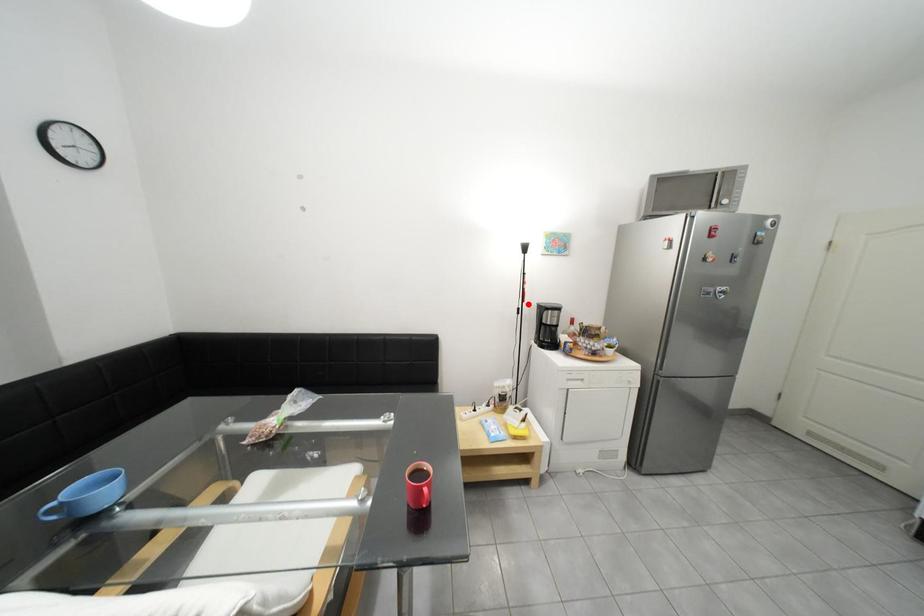
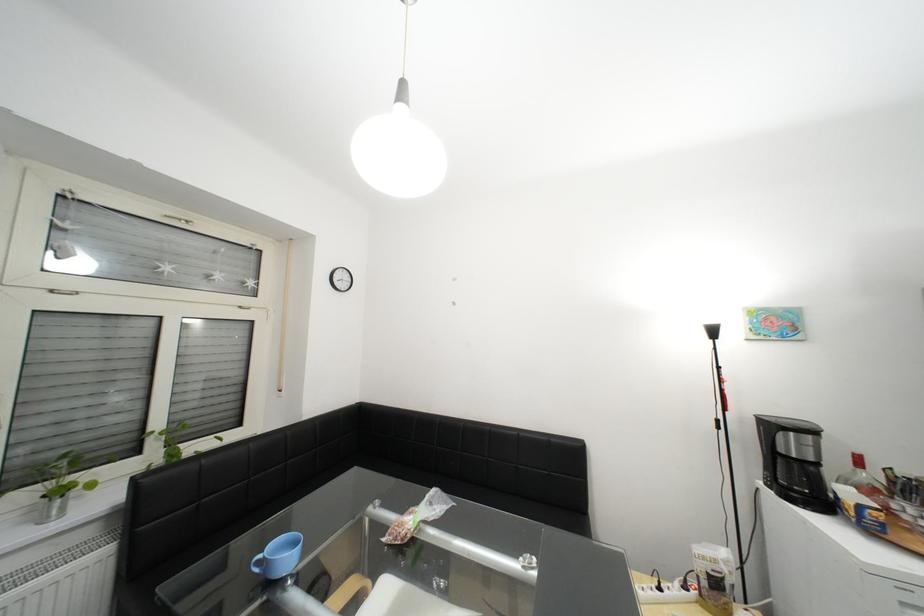
Find the pixel in the second image that matches the highlighted location in the first image.

(723, 411)